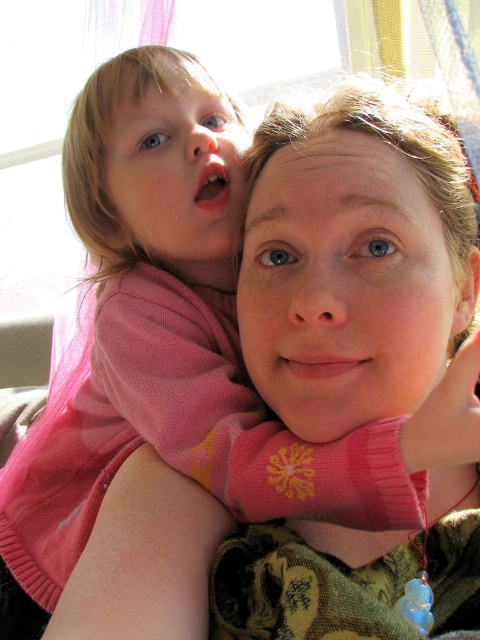
Does smooth skin face at center have a greater width compared to matte pink sweater at upper left?

Indeed, smooth skin face at center has a greater width compared to matte pink sweater at upper left.

Is point (311, 257) positioned after point (122, 157)?

No, (311, 257) is closer to viewer.

Where is `smooth skin face at center`? smooth skin face at center is located at coordinates (344, 285).